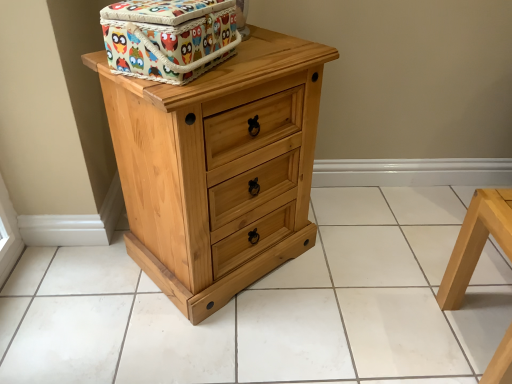
Question: Is natural wood chest of drawers at center wider than natural wood tile at center?

Choices:
 (A) no
 (B) yes

Answer: (A)

Question: Does natural wood chest of drawers at center have a larger size compared to natural wood tile at center?

Choices:
 (A) yes
 (B) no

Answer: (A)

Question: Is the position of natural wood chest of drawers at center more distant than that of natural wood tile at center?

Choices:
 (A) yes
 (B) no

Answer: (B)

Question: From a real-world perspective, is natural wood chest of drawers at center positioned over natural wood tile at center based on gravity?

Choices:
 (A) no
 (B) yes

Answer: (B)

Question: Is natural wood chest of drawers at center taller than natural wood tile at center?

Choices:
 (A) no
 (B) yes

Answer: (B)

Question: From the image's perspective, does natural wood chest of drawers at center appear lower than natural wood tile at center?

Choices:
 (A) yes
 (B) no

Answer: (B)

Question: Considering the relative sizes of light wood stool at lower right and natural wood tile at center in the image provided, is light wood stool at lower right bigger than natural wood tile at center?

Choices:
 (A) no
 (B) yes

Answer: (A)

Question: Is light wood stool at lower right smaller than natural wood tile at center?

Choices:
 (A) no
 (B) yes

Answer: (B)

Question: Does light wood stool at lower right have a greater width compared to natural wood tile at center?

Choices:
 (A) no
 (B) yes

Answer: (A)

Question: Does light wood stool at lower right have a lesser width compared to natural wood tile at center?

Choices:
 (A) yes
 (B) no

Answer: (A)

Question: Is light wood stool at lower right positioned beyond the bounds of natural wood tile at center?

Choices:
 (A) yes
 (B) no

Answer: (A)

Question: From a real-world perspective, is light wood stool at lower right beneath natural wood tile at center?

Choices:
 (A) yes
 (B) no

Answer: (B)

Question: From the image's perspective, is natural wood chest of drawers at center over light wood stool at lower right?

Choices:
 (A) yes
 (B) no

Answer: (A)